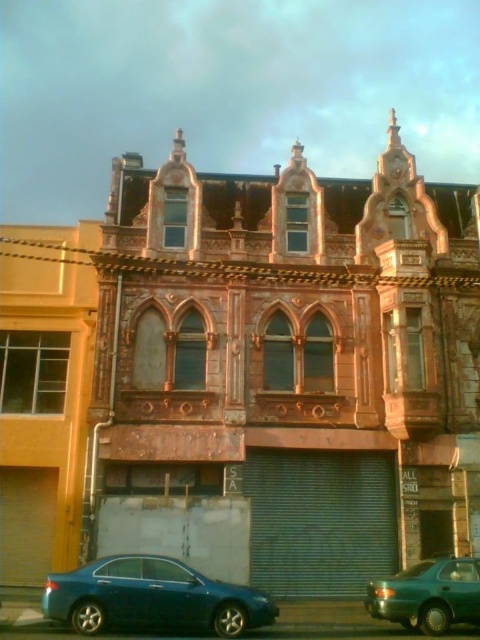
You are standing in front of the building and want to take a photo. There are two points marked on the building facade. The first point is at coordinates point (189, 577) and the second is at point (412, 604). Which point will appear larger in your camera view?

Point (189, 577) is closer to the camera than point (412, 604), so it will appear larger in the camera view.

You are standing at the entrance of the building and want to park your matte blue sedan at lower left. What are the coordinates where you should position it?

The coordinates for the matte blue sedan at lower left are at point (152,596).

You are a delivery driver who needs to park your vehicle between the two sedans. Your truck requires a minimum of 9 meters of space to maneuver. Based on the scene, can you safely park your truck between the matte blue sedan at lower left and the teal glossy sedan at lower right?

The distance between the matte blue sedan at lower left and the teal glossy sedan at lower right is 8.66 meters, which is less than the required 9 meters. Therefore, you cannot safely park your truck between them.